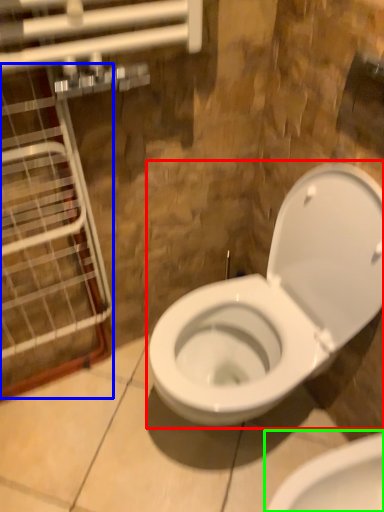
Question: Which is farther away from toilet (highlighted by a red box)? glass door (highlighted by a blue box) or toilet (highlighted by a green box)?

Choices:
 (A) glass door
 (B) toilet

Answer: (A)